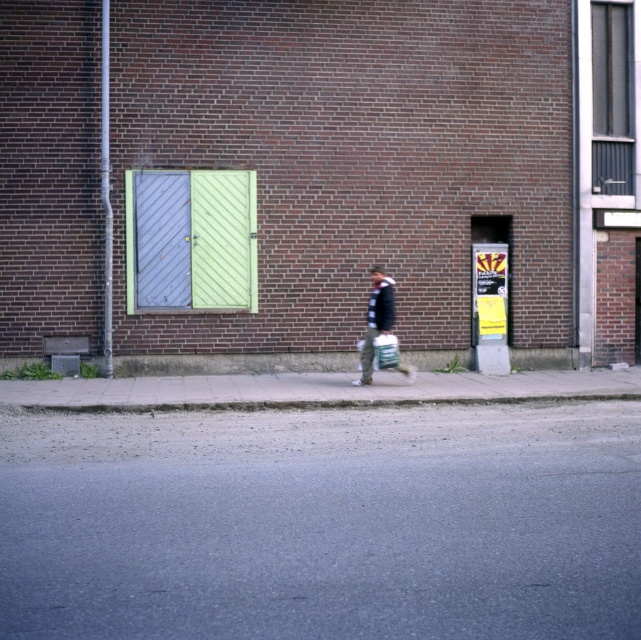
You are standing on the sidewalk in front of the brick building and want to determine the relative positions of two points marked on the facade. Which point is closer to you, point (256, 268) or point (372, 360)?

Point (256, 268) is further to the viewer than point (372, 360), so point (372, 360) is closer to you.

You are a delivery person standing on the gray asphalt at lower center. You need to place a package on the metallic gray shutter at upper right. Can you reach it from your current position?

The gray asphalt at lower center has a lesser height compared to metallic gray shutter at upper right, so you cannot reach the metallic gray shutter at upper right from the gray asphalt at lower center due to the height difference.